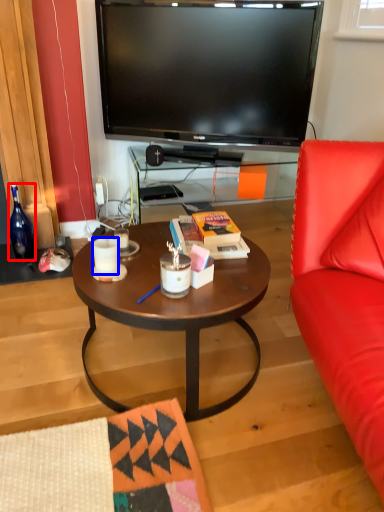
Question: Which point is further to the camera, bottle (highlighted by a red box) or coffee cup (highlighted by a blue box)?

Choices:
 (A) bottle
 (B) coffee cup

Answer: (A)